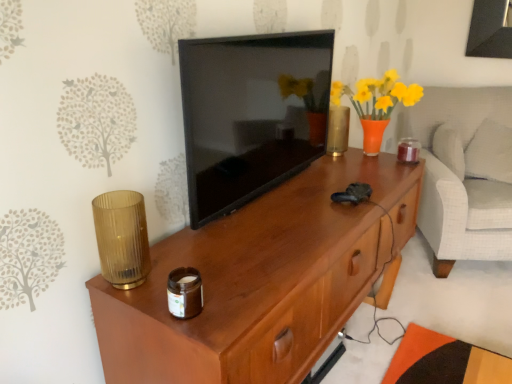
At what (x,y) coordinates should I click in order to perform the action: click on vacant space underneath black glossy tv at center (from a real-world perspective). Please return your answer as a coordinate pair (x, y). Looking at the image, I should click on (266, 192).